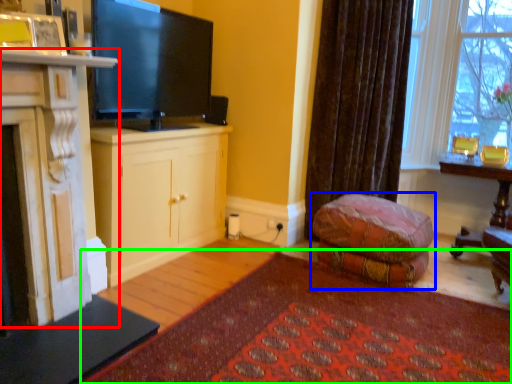
Question: Estimate the real-world distances between objects in this image. Which object is farther from cabinetry (highlighted by a red box), studio couch (highlighted by a blue box) or plain (highlighted by a green box)?

Choices:
 (A) studio couch
 (B) plain

Answer: (A)